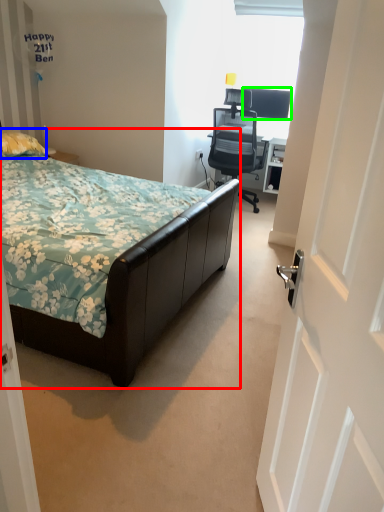
Question: Which is farther away from bed (highlighted by a red box)? pillow (highlighted by a blue box) or television (highlighted by a green box)?

Choices:
 (A) pillow
 (B) television

Answer: (B)